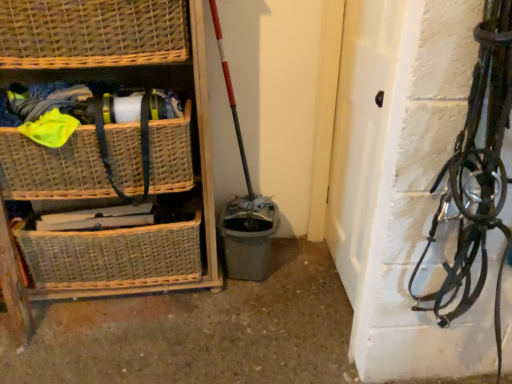
Question: In terms of width, does woven wicker basket at lower left, positioned as the 3th basket in top-to-bottom order, look wider or thinner when compared to woven wicker basket at left, the second basket positioned from the top?

Choices:
 (A) thin
 (B) wide

Answer: (A)

Question: Looking at the image, does woven wicker basket at lower left, which appears as the first basket when ordered from the bottom, seem bigger or smaller compared to woven wicker basket at left, the second basket positioned from the top?

Choices:
 (A) small
 (B) big

Answer: (A)

Question: Estimate the real-world distances between objects in this image. Which object is closer to the white matte door at center?

Choices:
 (A) woven wicker basket at upper left, placed as the 1th basket when sorted from top to bottom
 (B) woven wicker basket at lower left, positioned as the 3th basket in top-to-bottom order
 (C) woven wicker basket at left, the second basket positioned from the top
 (D) woven wicker basket at left

Answer: (D)

Question: Which object is the closest to the woven wicker basket at left, the second basket positioned from the top?

Choices:
 (A) woven wicker basket at lower left, positioned as the 3th basket in top-to-bottom order
 (B) woven wicker basket at upper left, placed as the 1th basket when sorted from top to bottom
 (C) white matte door at center
 (D) woven wicker basket at left

Answer: (D)